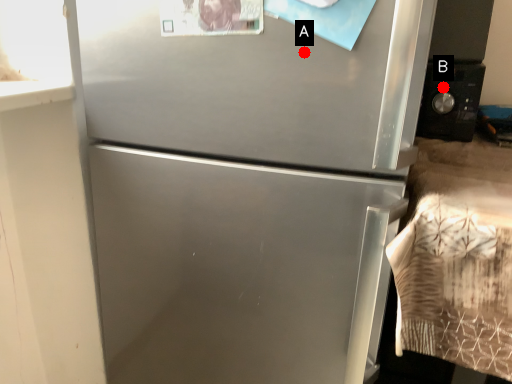
Question: Two points are circled on the image, labeled by A and B beside each circle. Which point appears closest to the camera in this image?

Choices:
 (A) A is closer
 (B) B is closer

Answer: (A)